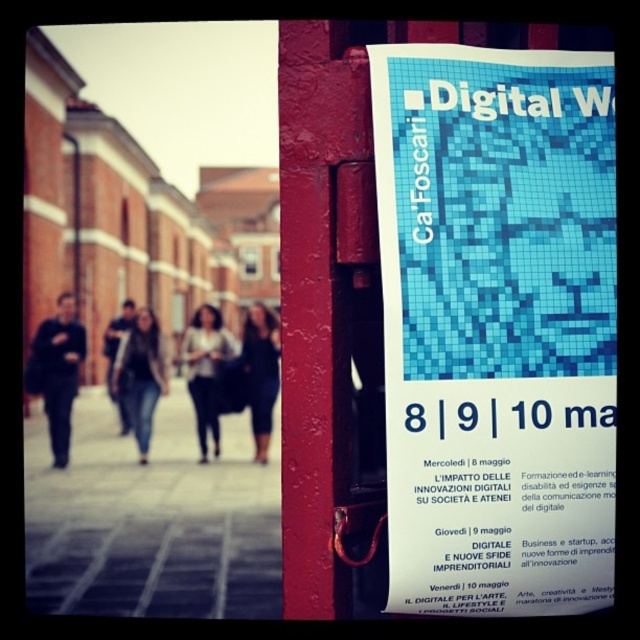
Question: Where is dark gray sweater at left located in relation to dark blue dress at center in the image?

Choices:
 (A) above
 (B) below

Answer: (A)

Question: Is blue mosaic poster at right closer to camera compared to dark gray sweater at center?

Choices:
 (A) yes
 (B) no

Answer: (A)

Question: Which point is farther from the camera taking this photo?

Choices:
 (A) (145, 336)
 (B) (193, 320)
 (C) (269, 413)
 (D) (113, 336)

Answer: (B)

Question: Which object appears farthest from the camera in this image?

Choices:
 (A) dark gray sweater at center
 (B) blue mosaic poster at right
 (C) jeans at center
 (D) dark gray sweater at left

Answer: (A)

Question: Is blue mosaic poster at right in front of dark gray sweater at center?

Choices:
 (A) no
 (B) yes

Answer: (B)

Question: Which point is closer to the camera?

Choices:
 (A) dark blue dress at center
 (B) jeans at center
 (C) gray concrete pavement at lower center

Answer: (C)